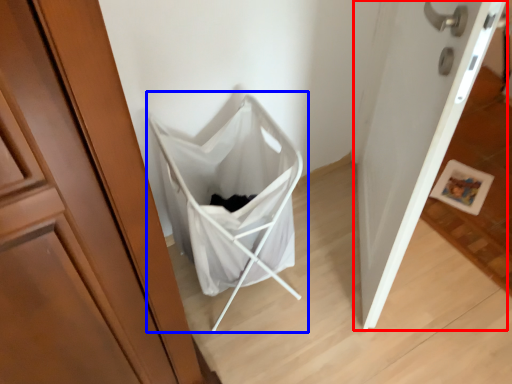
Question: Which point is further to the camera, door (highlighted by a red box) or baby carriage (highlighted by a blue box)?

Choices:
 (A) door
 (B) baby carriage

Answer: (B)